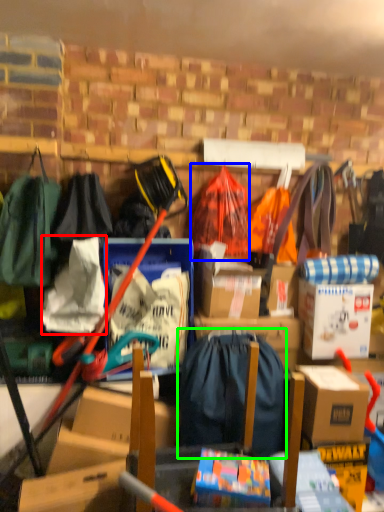
Question: Based on their relative distances, which object is farther from clothing (highlighted by a red box)? Choose from clothing (highlighted by a blue box) and backpack (highlighted by a green box).

Choices:
 (A) clothing
 (B) backpack

Answer: (A)